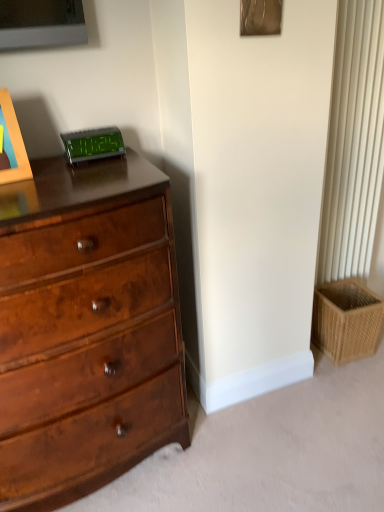
Identify the location of vacant area on top of shiny brown wood chest of drawers at left (from a real-world perspective). The height and width of the screenshot is (512, 384). (69, 180).